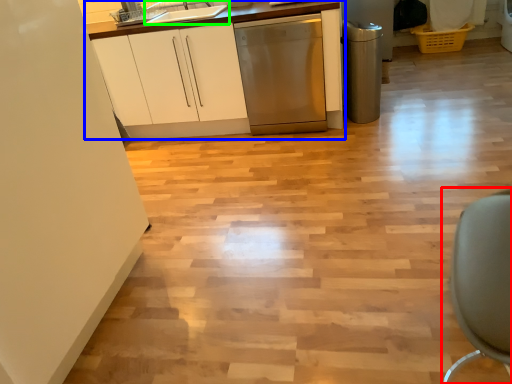
Question: Considering the real-world distances, which object is closest to swivel chair (highlighted by a red box)? cabinetry (highlighted by a blue box) or sink (highlighted by a green box).

Choices:
 (A) cabinetry
 (B) sink

Answer: (B)